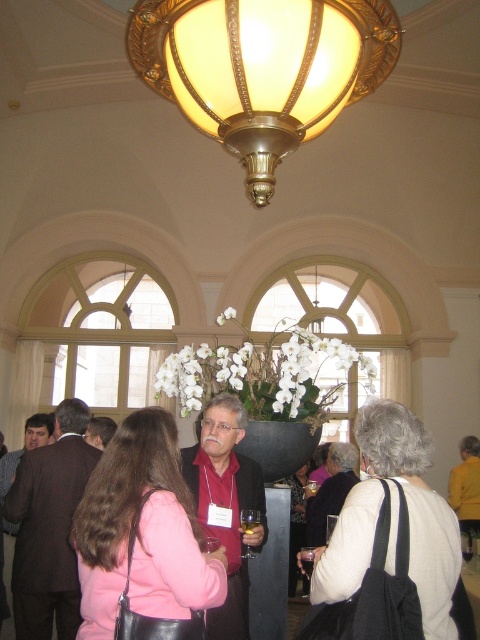
Question: Which point is closer to the camera taking this photo?

Choices:
 (A) (50, 481)
 (B) (342, 492)
 (C) (248, 554)

Answer: (C)

Question: Is pink fabric purse at center positioned at the back of dark brown suit at center?

Choices:
 (A) no
 (B) yes

Answer: (A)

Question: Among these points, which one is farthest from the camera?

Choices:
 (A) (291, 536)
 (B) (384, 596)
 (C) (208, 620)

Answer: (A)

Question: Is dark brown suit at center positioned before clear glass wine glass at center?

Choices:
 (A) no
 (B) yes

Answer: (A)

Question: Which point appears closest to the camera in this image?

Choices:
 (A) (241, 160)
 (B) (243, 516)

Answer: (B)

Question: Is gold metallic lampshade at upper center below matte black jacket at center?

Choices:
 (A) no
 (B) yes

Answer: (A)